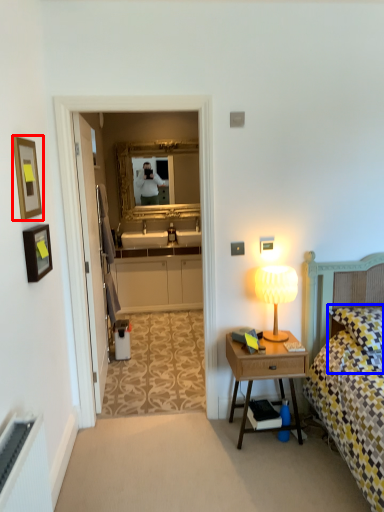
Question: Which object appears closest to the camera in this image, picture frame (highlighted by a red box) or pillow (highlighted by a blue box)?

Choices:
 (A) picture frame
 (B) pillow

Answer: (A)